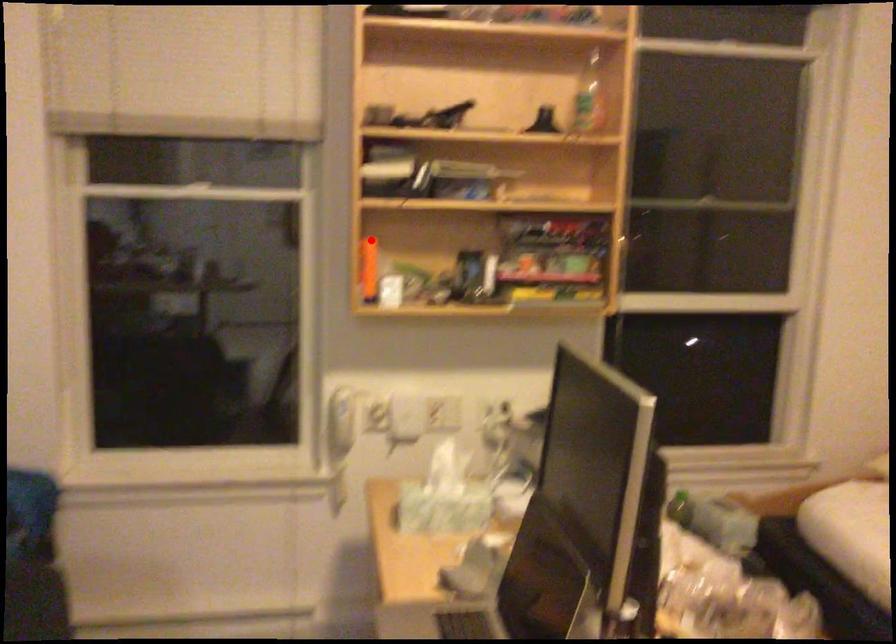
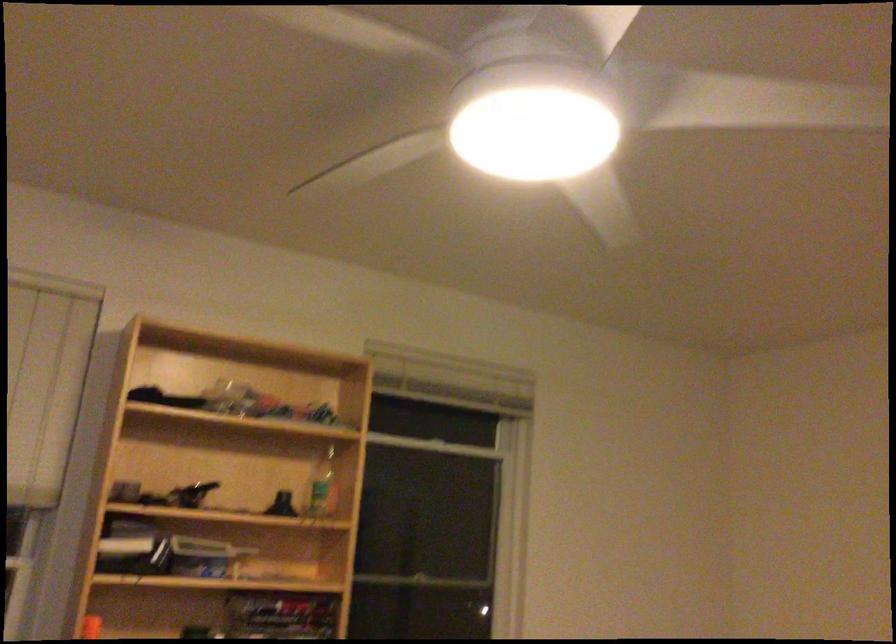
In the second image, find the point that corresponds to the highlighted location in the first image.

(90, 627)